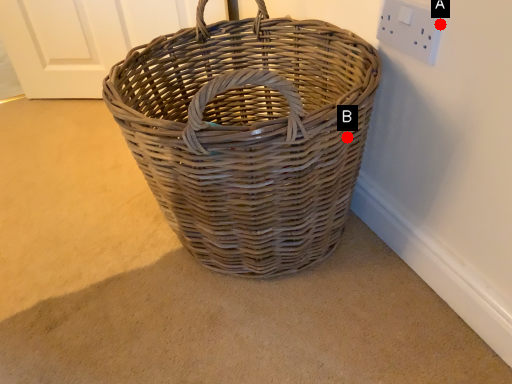
Question: Two points are circled on the image, labeled by A and B beside each circle. Which of the following is the closest to the observer?

Choices:
 (A) A is closer
 (B) B is closer

Answer: (A)